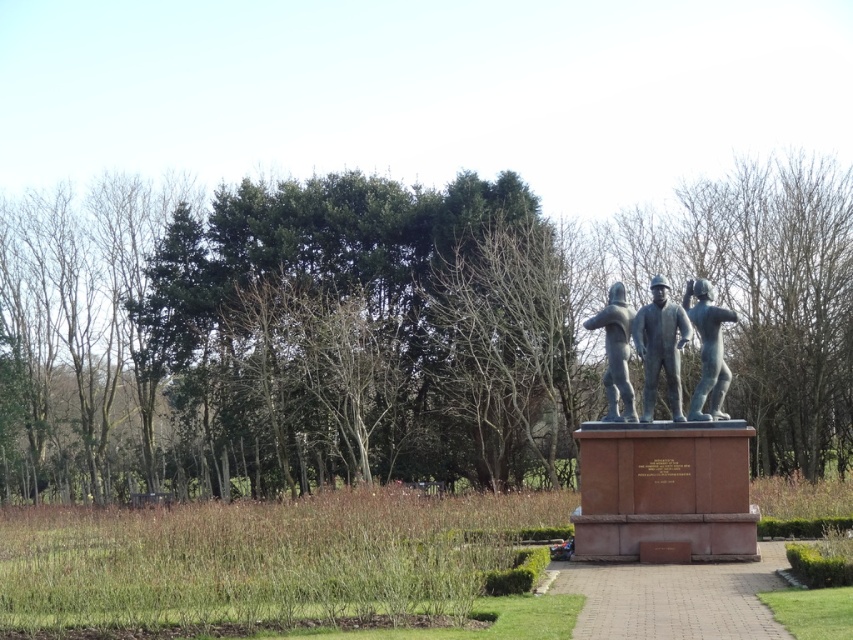
Which is above, green leafy tree at center or bronze statue at right?

Positioned higher is bronze statue at right.

Which is behind, point (485, 266) or point (714, 404)?

The point (485, 266) is behind.

This screenshot has height=640, width=853. I want to click on green leafy tree at center, so click(x=393, y=330).

Is green leafy tree at center further to camera compared to polished silver statue at center?

No, green leafy tree at center is closer to the viewer.

Is green leafy tree at center closer to the viewer compared to polished silver statue at center?

→ Yes, green leafy tree at center is in front of polished silver statue at center.

Between point (444, 300) and point (688, 336), which one is positioned behind?

The point (444, 300) is behind.

Locate an element on the screen. The height and width of the screenshot is (640, 853). green leafy tree at center is located at coordinates (393, 330).

The height and width of the screenshot is (640, 853). Describe the element at coordinates (393, 330) in the screenshot. I see `green leafy tree at center` at that location.

The image size is (853, 640). I want to click on green leafy tree at center, so click(393, 330).